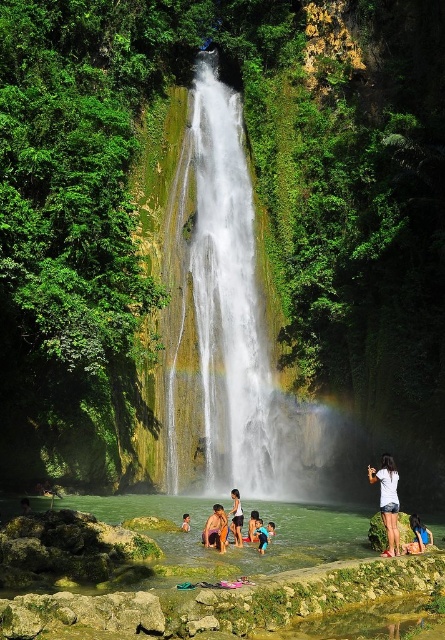
Between pink swim trunks at lower center and blue wetsuit child at lower center, which one appears on the right side from the viewer's perspective?

blue wetsuit child at lower center is more to the right.

Between point (217, 518) and point (267, 528), which one is positioned behind?

Point (267, 528)

The height and width of the screenshot is (640, 445). What do you see at coordinates (213, 529) in the screenshot?
I see `pink swim trunks at lower center` at bounding box center [213, 529].

You are a GUI agent. You are given a task and a screenshot of the screen. Output one action in this format:
    pyautogui.click(x=<x>, y=<y>)
    Task: Click on the pink swim trunks at lower center
    This screenshot has height=640, width=445.
    Given the screenshot: What is the action you would take?
    pyautogui.click(x=213, y=529)

Identify the location of white cotton shorts at lower right. The image size is (445, 640). (388, 500).

At what (x,y) coordinates should I click in order to perform the action: click on white cotton shorts at lower right. Please return your answer as a coordinate pair (x, y). The height and width of the screenshot is (640, 445). Looking at the image, I should click on (388, 500).

Locate an element on the screen. white cotton shorts at lower right is located at coordinates (388, 500).

Consider the image. Can you confirm if white smooth waterfall at center is positioned below clear water at lower center?

No.

Which is above, white smooth waterfall at center or clear water at lower center?

white smooth waterfall at center is above.

You are a GUI agent. You are given a task and a screenshot of the screen. Output one action in this format:
    pyautogui.click(x=<x>, y=<y>)
    Task: Click on the white smooth waterfall at center
    The height and width of the screenshot is (640, 445).
    Given the screenshot: What is the action you would take?
    pyautogui.click(x=231, y=305)